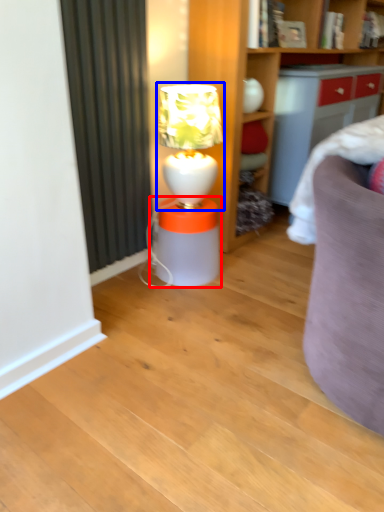
Question: Which object appears closest to the camera in this image, table (highlighted by a red box) or table lamp (highlighted by a blue box)?

Choices:
 (A) table
 (B) table lamp

Answer: (B)